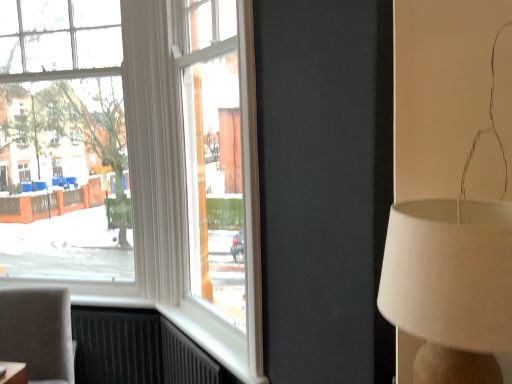
Question: From their relative heights in the image, would you say clear glass window at left is taller or shorter than white fabric lampshade at right?

Choices:
 (A) short
 (B) tall

Answer: (B)

Question: Is clear glass window at left bigger or smaller than white fabric lampshade at right?

Choices:
 (A) small
 (B) big

Answer: (B)

Question: Estimate the real-world distances between objects in this image. Which object is farther from the white fabric lampshade at right?

Choices:
 (A) clear glass window at left
 (B) matte gray chair at lower left

Answer: (A)

Question: Estimate the real-world distances between objects in this image. Which object is farther from the matte gray chair at lower left?

Choices:
 (A) clear glass window at left
 (B) white fabric lampshade at right

Answer: (B)